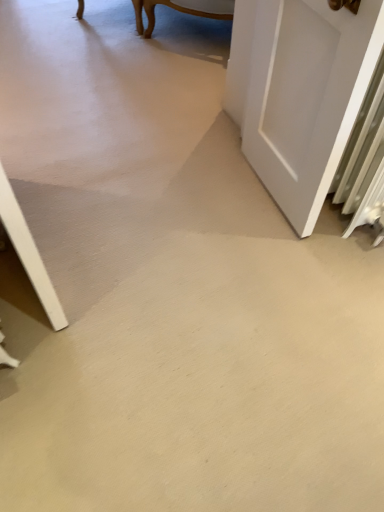
Where is `free spot above smooth concrete floor at center (from a real-world perspective)`? The width and height of the screenshot is (384, 512). free spot above smooth concrete floor at center (from a real-world perspective) is located at coordinates (184, 288).